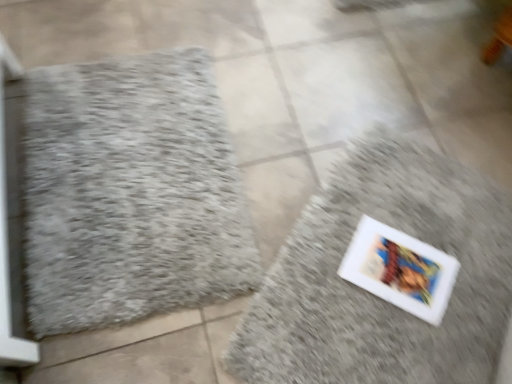
Identify the location of gray fluffy bath mat at left, the 2th bath mat when ordered from right to left. (131, 193).

Describe the element at coordinates (131, 193) in the screenshot. I see `gray fluffy bath mat at left, which appears as the 1th bath mat when viewed from the left` at that location.

This screenshot has height=384, width=512. What do you see at coordinates (374, 295) in the screenshot?
I see `white matte book at lower right, the first bath mat from the right` at bounding box center [374, 295].

This screenshot has width=512, height=384. What are the coordinates of `white matte book at lower right, marked as the second bath mat in a left-to-right arrangement` in the screenshot? It's located at (374, 295).

Where is `gray fluffy bath mat at left, which appears as the 1th bath mat when viewed from the left`? gray fluffy bath mat at left, which appears as the 1th bath mat when viewed from the left is located at coordinates (131, 193).

In the image, is gray fluffy bath mat at left, the 2th bath mat when ordered from right to left, on the left side or the right side of white matte book at lower right, marked as the second bath mat in a left-to-right arrangement?

gray fluffy bath mat at left, the 2th bath mat when ordered from right to left, is to the left of white matte book at lower right, marked as the second bath mat in a left-to-right arrangement.

Which object is closer to the camera, gray fluffy bath mat at left, the 2th bath mat when ordered from right to left, or white matte book at lower right, marked as the second bath mat in a left-to-right arrangement?

white matte book at lower right, marked as the second bath mat in a left-to-right arrangement, is more forward.

Which is closer, (106, 133) or (451, 236)?

The point (451, 236) is more forward.

From the image's perspective, would you say gray fluffy bath mat at left, the 2th bath mat when ordered from right to left, is shown under white matte book at lower right, marked as the second bath mat in a left-to-right arrangement?

Actually, gray fluffy bath mat at left, the 2th bath mat when ordered from right to left, appears above white matte book at lower right, marked as the second bath mat in a left-to-right arrangement, in the image.

From a real-world perspective, is gray fluffy bath mat at left, which appears as the 1th bath mat when viewed from the left, on top of white matte book at lower right, the first bath mat from the right?

Yes, from a real-world perspective, gray fluffy bath mat at left, which appears as the 1th bath mat when viewed from the left, is on top of white matte book at lower right, the first bath mat from the right.

Considering the relative sizes of gray fluffy bath mat at left, the 2th bath mat when ordered from right to left, and white matte book at lower right, marked as the second bath mat in a left-to-right arrangement, in the image provided, is gray fluffy bath mat at left, the 2th bath mat when ordered from right to left, wider than white matte book at lower right, marked as the second bath mat in a left-to-right arrangement,?

Incorrect, the width of gray fluffy bath mat at left, the 2th bath mat when ordered from right to left, does not surpass that of white matte book at lower right, marked as the second bath mat in a left-to-right arrangement.

Can you confirm if gray fluffy bath mat at left, the 2th bath mat when ordered from right to left, is shorter than white matte book at lower right, marked as the second bath mat in a left-to-right arrangement?

Correct, gray fluffy bath mat at left, the 2th bath mat when ordered from right to left, is not as tall as white matte book at lower right, marked as the second bath mat in a left-to-right arrangement.

Does gray fluffy bath mat at left, which appears as the 1th bath mat when viewed from the left, have a larger size compared to white matte book at lower right, marked as the second bath mat in a left-to-right arrangement?

Actually, gray fluffy bath mat at left, which appears as the 1th bath mat when viewed from the left, might be smaller than white matte book at lower right, marked as the second bath mat in a left-to-right arrangement.

Is gray fluffy bath mat at left, the 2th bath mat when ordered from right to left, not inside white matte book at lower right, the first bath mat from the right?

That's correct, gray fluffy bath mat at left, the 2th bath mat when ordered from right to left, is outside of white matte book at lower right, the first bath mat from the right.

Is the surface of gray fluffy bath mat at left, which appears as the 1th bath mat when viewed from the left, in direct contact with white matte book at lower right, marked as the second bath mat in a left-to-right arrangement?

No, gray fluffy bath mat at left, which appears as the 1th bath mat when viewed from the left, is not in contact with white matte book at lower right, marked as the second bath mat in a left-to-right arrangement.

Is gray fluffy bath mat at left, which appears as the 1th bath mat when viewed from the left, oriented away from white matte book at lower right, the first bath mat from the right?

No, gray fluffy bath mat at left, which appears as the 1th bath mat when viewed from the left,'s orientation is not away from white matte book at lower right, the first bath mat from the right.

How far apart are gray fluffy bath mat at left, the 2th bath mat when ordered from right to left, and white matte book at lower right, marked as the second bath mat in a left-to-right arrangement?

gray fluffy bath mat at left, the 2th bath mat when ordered from right to left, and white matte book at lower right, marked as the second bath mat in a left-to-right arrangement, are 47.09 centimeters apart from each other.

Where is `bath mat located below the gray fluffy bath mat at left, the 2th bath mat when ordered from right to left (from the image's perspective)`? bath mat located below the gray fluffy bath mat at left, the 2th bath mat when ordered from right to left (from the image's perspective) is located at coordinates (374, 295).

Which object is positioned more to the right, white matte book at lower right, the first bath mat from the right, or gray fluffy bath mat at left, the 2th bath mat when ordered from right to left?

white matte book at lower right, the first bath mat from the right, is more to the right.

Between white matte book at lower right, the first bath mat from the right, and gray fluffy bath mat at left, which appears as the 1th bath mat when viewed from the left, which one is positioned behind?

Positioned behind is gray fluffy bath mat at left, which appears as the 1th bath mat when viewed from the left.

Considering the positions of points (397, 192) and (97, 277), is point (397, 192) closer to camera compared to point (97, 277)?

No, (397, 192) is further to viewer.

From the image's perspective, is white matte book at lower right, marked as the second bath mat in a left-to-right arrangement, positioned above or below gray fluffy bath mat at left, which appears as the 1th bath mat when viewed from the left?

Based on their image positions, white matte book at lower right, marked as the second bath mat in a left-to-right arrangement, is located beneath gray fluffy bath mat at left, which appears as the 1th bath mat when viewed from the left.

From a real-world perspective, between white matte book at lower right, marked as the second bath mat in a left-to-right arrangement, and gray fluffy bath mat at left, the 2th bath mat when ordered from right to left, who is vertically higher?

From a 3D spatial view, gray fluffy bath mat at left, the 2th bath mat when ordered from right to left, is above.

Which object is thinner, white matte book at lower right, marked as the second bath mat in a left-to-right arrangement, or gray fluffy bath mat at left, which appears as the 1th bath mat when viewed from the left?

→ gray fluffy bath mat at left, which appears as the 1th bath mat when viewed from the left.

Considering the relative sizes of white matte book at lower right, the first bath mat from the right, and gray fluffy bath mat at left, which appears as the 1th bath mat when viewed from the left, in the image provided, is white matte book at lower right, the first bath mat from the right, taller than gray fluffy bath mat at left, which appears as the 1th bath mat when viewed from the left,?

Correct, white matte book at lower right, the first bath mat from the right, is much taller as gray fluffy bath mat at left, which appears as the 1th bath mat when viewed from the left.

Who is bigger, white matte book at lower right, marked as the second bath mat in a left-to-right arrangement, or gray fluffy bath mat at left, which appears as the 1th bath mat when viewed from the left?

white matte book at lower right, marked as the second bath mat in a left-to-right arrangement.

Is white matte book at lower right, the first bath mat from the right, spatially inside gray fluffy bath mat at left, the 2th bath mat when ordered from right to left, or outside of it?

white matte book at lower right, the first bath mat from the right, is located beyond the bounds of gray fluffy bath mat at left, the 2th bath mat when ordered from right to left.

Is white matte book at lower right, the first bath mat from the right, positioned far away from gray fluffy bath mat at left, the 2th bath mat when ordered from right to left?

That's not correct — white matte book at lower right, the first bath mat from the right, is a little close to gray fluffy bath mat at left, the 2th bath mat when ordered from right to left.

Could you tell me if white matte book at lower right, marked as the second bath mat in a left-to-right arrangement, is facing gray fluffy bath mat at left, the 2th bath mat when ordered from right to left?

Yes, white matte book at lower right, marked as the second bath mat in a left-to-right arrangement, is facing gray fluffy bath mat at left, the 2th bath mat when ordered from right to left.

How many degrees apart are the facing directions of white matte book at lower right, marked as the second bath mat in a left-to-right arrangement, and gray fluffy bath mat at left, which appears as the 1th bath mat when viewed from the left?

The facing directions of white matte book at lower right, marked as the second bath mat in a left-to-right arrangement, and gray fluffy bath mat at left, which appears as the 1th bath mat when viewed from the left, are 132 degrees apart.

There is a white matte book at lower right, marked as the second bath mat in a left-to-right arrangement. Where is `bath mat above it (from a real-world perspective)`? Image resolution: width=512 pixels, height=384 pixels. bath mat above it (from a real-world perspective) is located at coordinates (131, 193).

Identify the location of bath mat to the right of gray fluffy bath mat at left, the 2th bath mat when ordered from right to left. The width and height of the screenshot is (512, 384). (374, 295).

Locate an element on the screen. bath mat that is behind the white matte book at lower right, marked as the second bath mat in a left-to-right arrangement is located at coordinates (131, 193).